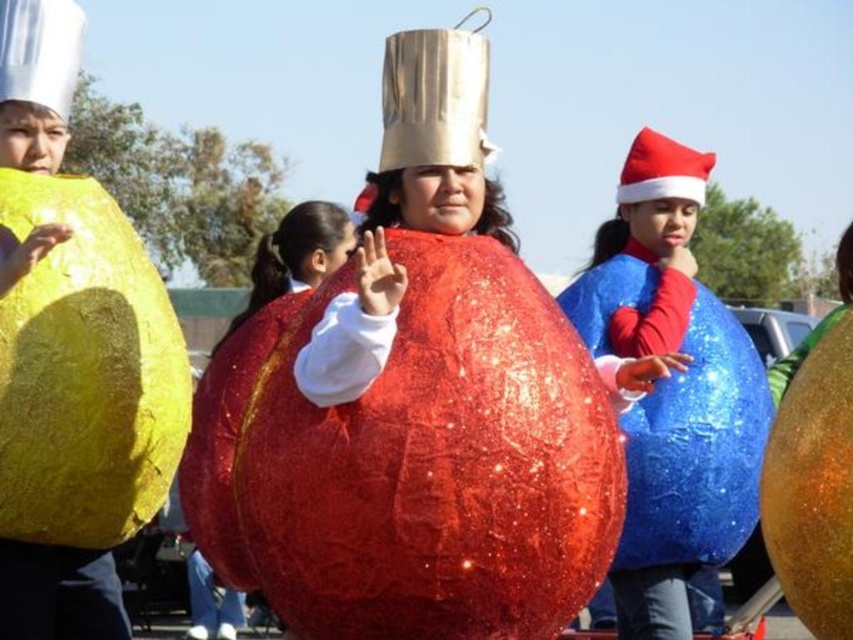
The width and height of the screenshot is (853, 640). Identify the location of shiny red balloon at center. 413,461.

Between blue sparkly balloon at right and white paper christmas hat at upper left, which one is positioned higher?

white paper christmas hat at upper left

Does blue sparkly balloon at right appear on the right side of white paper christmas hat at upper left?

Yes, blue sparkly balloon at right is to the right of white paper christmas hat at upper left.

Does point (601, 312) lie in front of point (15, 88)?

No.

Find the location of a particular element. The height and width of the screenshot is (640, 853). blue sparkly balloon at right is located at coordinates click(x=646, y=256).

Which is behind, point (21, 86) or point (659, 173)?

Point (659, 173)

Measure the distance between white paper christmas hat at upper left and red felt santa hat at upper right.

white paper christmas hat at upper left is 9.36 meters away from red felt santa hat at upper right.

At what (x,y) coordinates should I click in order to perform the action: click on white paper christmas hat at upper left. Please return your answer as a coordinate pair (x, y). Looking at the image, I should click on (39, 51).